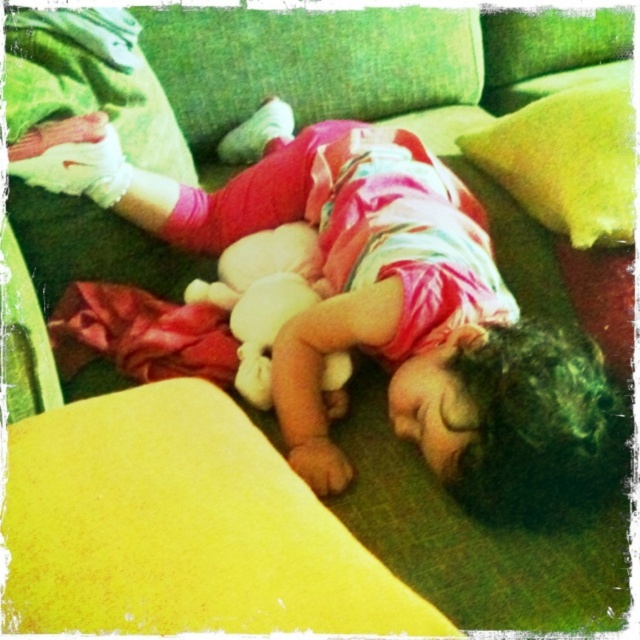
You are a parent looking for your child. You see the soft pink fabric at center and the fluffy white teddy bear at center in the image. Which object is closer to the right side of the image?

The soft pink fabric at center is to the right of the fluffy white teddy bear at center, so it is closer to the right side of the image.

You are a photographer setting up a shoot in this scene. You need to place a small lamp between the green fabric pillow at upper center and the fluffy white teddy bear at center. Which object should the lamp be closer to in order to avoid blocking the teddy bear?

The lamp should be placed closer to the fluffy white teddy bear at center because the green fabric pillow at upper center is much taller, so positioning the lamp near the teddy bear will prevent it from being blocked by the taller pillow.

You are a photographer setting up a shoot in the room where the child is sleeping. You need to place a small decorative vase between the green fabric pillow at upper center and the fluffy white teddy bear at center. Based on their sizes, which object should the vase be closer to?

The green fabric pillow at upper center is larger in size than the fluffy white teddy bear at center. Therefore, the vase should be placed closer to the fluffy white teddy bear at center to balance the composition.